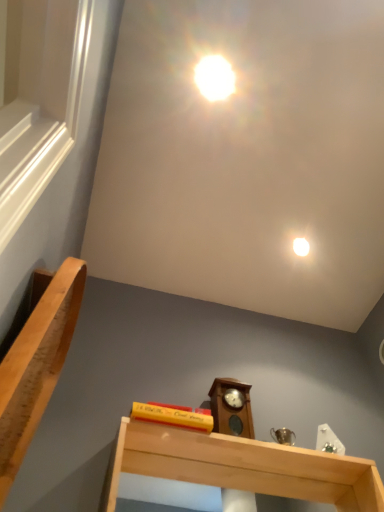
Find the location of `vacant space that is to the left of white glossy droplight at upper center`. vacant space that is to the left of white glossy droplight at upper center is located at coordinates (273, 246).